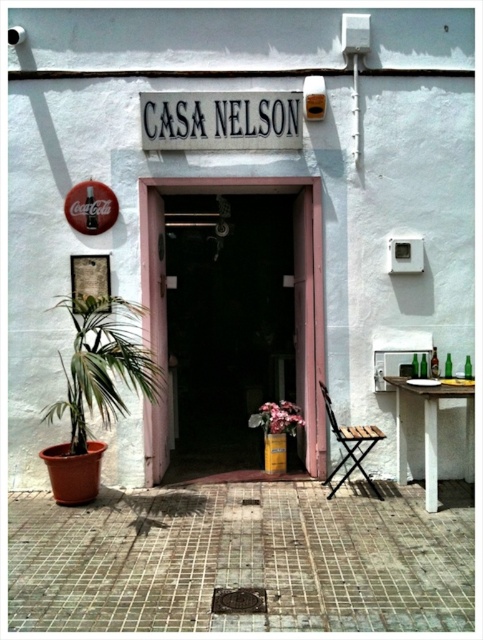
Question: Does white wooden table at lower right have a larger size compared to pink matte flower at center?

Choices:
 (A) yes
 (B) no

Answer: (A)

Question: Which point is farther to the camera?

Choices:
 (A) (96, 316)
 (B) (458, 392)
 (C) (322, 392)
 (D) (270, 412)

Answer: (D)

Question: Which object is the closest to the wooden folding chair at lower right?

Choices:
 (A) white wooden table at lower right
 (B) pink matte flower at center

Answer: (A)

Question: Which point is farther to the camera?

Choices:
 (A) (269, 428)
 (B) (352, 456)

Answer: (A)

Question: Is green leafy plant at left above pink matte flower at center?

Choices:
 (A) yes
 (B) no

Answer: (A)

Question: Does white wooden table at lower right appear under pink matte flower at center?

Choices:
 (A) no
 (B) yes

Answer: (B)